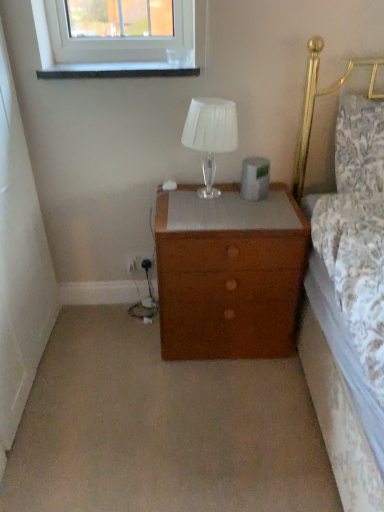
Find the location of `free spot below translucent glass table lamp at upper center (from a real-world perspective)`. free spot below translucent glass table lamp at upper center (from a real-world perspective) is located at coordinates (200, 189).